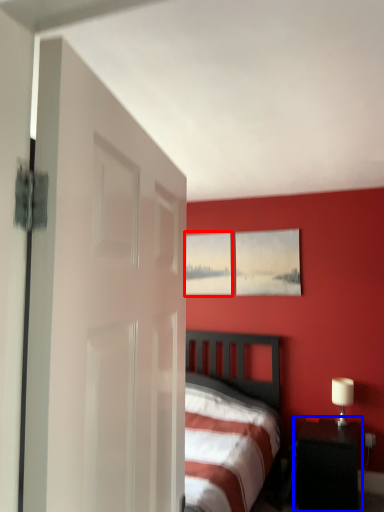
Question: Which point is closer to the camera, picture frame (highlighted by a red box) or nightstand (highlighted by a blue box)?

Choices:
 (A) picture frame
 (B) nightstand

Answer: (B)